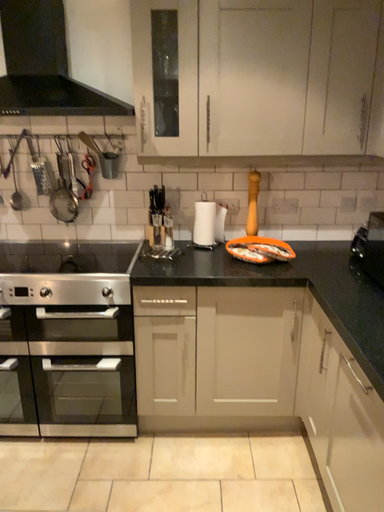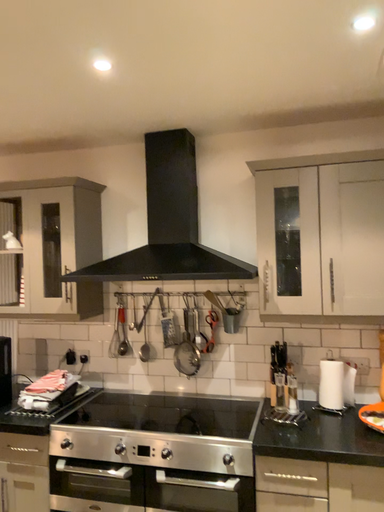
Question: How did the camera likely rotate when shooting the video?

Choices:
 (A) rotated downward
 (B) rotated upward

Answer: (B)